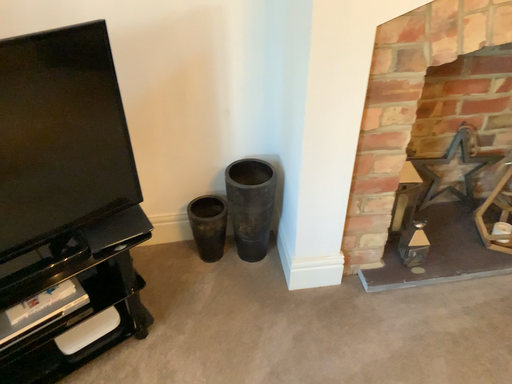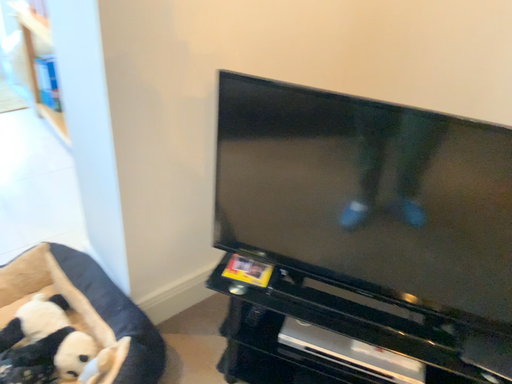
Question: How did the camera likely rotate when shooting the video?

Choices:
 (A) rotated upward
 (B) rotated downward

Answer: (A)